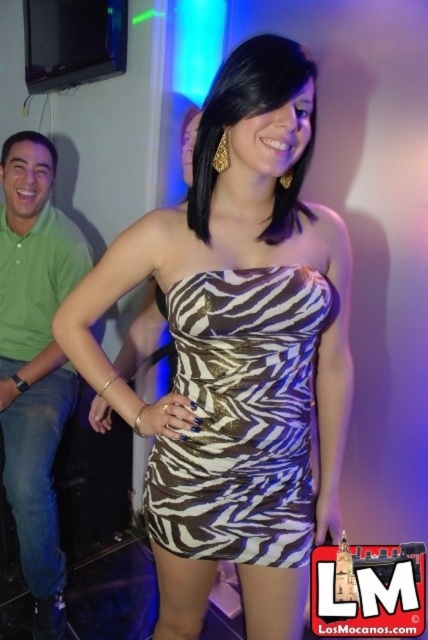
Question: Can you confirm if zebra print dress at center is positioned to the left of zebra print strapless dress at center?

Choices:
 (A) no
 (B) yes

Answer: (B)

Question: Among these objects, which one is farthest from the camera?

Choices:
 (A) green cotton shirt at left
 (B) zebra print strapless dress at center
 (C) zebra print dress at center

Answer: (A)

Question: Which of these objects is positioned farthest from the zebra print strapless dress at center?

Choices:
 (A) green cotton shirt at left
 (B) zebra print dress at center

Answer: (A)

Question: Is zebra print strapless dress at center to the left of green cotton shirt at left from the viewer's perspective?

Choices:
 (A) no
 (B) yes

Answer: (A)

Question: Is zebra print strapless dress at center further to camera compared to green cotton shirt at left?

Choices:
 (A) yes
 (B) no

Answer: (B)

Question: Which object appears closest to the camera in this image?

Choices:
 (A) zebra print dress at center
 (B) zebra print strapless dress at center

Answer: (A)